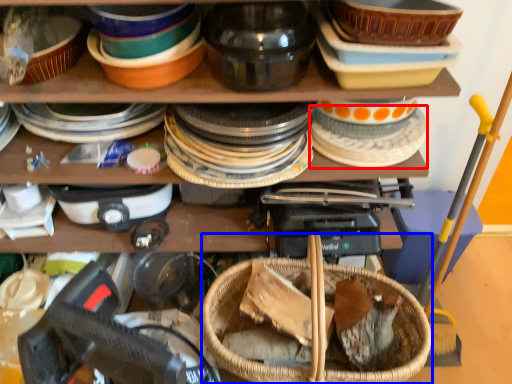
Question: Among these objects, which one is nearest to the camera, tableware (highlighted by a red box) or basket (highlighted by a blue box)?

Choices:
 (A) tableware
 (B) basket

Answer: (B)